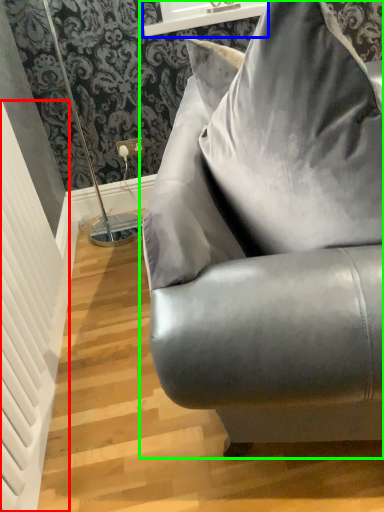
Question: Based on their relative distances, which object is nearer to radiator (highlighted by a red box)? Choose from window sill (highlighted by a blue box) and studio couch (highlighted by a green box).

Choices:
 (A) window sill
 (B) studio couch

Answer: (B)